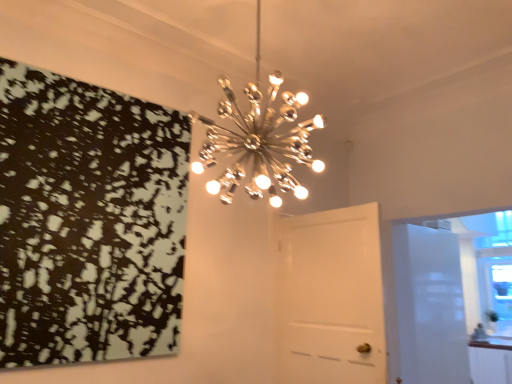
Measure the distance between white glossy cabinetry at lower right and camera.

white glossy cabinetry at lower right is 3.82 meters away from camera.

This screenshot has width=512, height=384. What do you see at coordinates (429, 305) in the screenshot?
I see `white glossy door at right, the 2th door when ordered from front to back` at bounding box center [429, 305].

What is the approximate width of white glossy door at center, the 2th door positioned from the right?

white glossy door at center, the 2th door positioned from the right, is 16.34 centimeters wide.

Describe the element at coordinates (331, 297) in the screenshot. I see `white glossy door at center, placed as the 1th door when sorted from front to back` at that location.

Describe the element at coordinates (88, 221) in the screenshot. This screenshot has height=384, width=512. I see `black matte print at upper left` at that location.

Where is `white glossy cabinetry at lower right`? white glossy cabinetry at lower right is located at coordinates pos(490,362).

Is metallic starburst chandelier at upper center outside of white glossy door at center, the 2th door positioned from the back?

Absolutely, metallic starburst chandelier at upper center is external to white glossy door at center, the 2th door positioned from the back.

Is metallic starburst chandelier at upper center not near white glossy door at center, the 1th door from the left?

Actually, metallic starburst chandelier at upper center and white glossy door at center, the 1th door from the left, are a little close together.

Locate an element on the screen. This screenshot has width=512, height=384. the 1st door located beneath the metallic starburst chandelier at upper center (from a real-world perspective) is located at coordinates (331, 297).

Considering the relative sizes of metallic starburst chandelier at upper center and white glossy door at center, the 2th door positioned from the right, in the image provided, is metallic starburst chandelier at upper center bigger than white glossy door at center, the 2th door positioned from the right,?

Indeed, metallic starburst chandelier at upper center has a larger size compared to white glossy door at center, the 2th door positioned from the right.

Is point (250, 195) farther from camera compared to point (496, 345)?

No, (250, 195) is in front of (496, 345).

Identify the location of lamp to the left of white glossy cabinetry at lower right. (258, 140).

From a real-world perspective, is metallic starburst chandelier at upper center beneath white glossy cabinetry at lower right?

Actually, metallic starburst chandelier at upper center is physically above white glossy cabinetry at lower right in the real world.

Does metallic starburst chandelier at upper center appear on the right side of white glossy cabinetry at lower right?

In fact, metallic starburst chandelier at upper center is to the left of white glossy cabinetry at lower right.

From the image's perspective, relative to white glossy door at right, the 2th door when ordered from front to back, is white glossy cabinetry at lower right above or below?

white glossy cabinetry at lower right is situated lower than white glossy door at right, the 2th door when ordered from front to back, in the image.

Does white glossy cabinetry at lower right have a smaller size compared to white glossy door at right, the 2th door when ordered from front to back?

Yes, white glossy cabinetry at lower right is smaller than white glossy door at right, the 2th door when ordered from front to back.

Which is closer, (469, 358) or (454, 319)?

Point (469, 358) appears to be closer to the viewer than point (454, 319).

From a real-world perspective, is white glossy door at right, which appears as the 2th door when viewed from the left, physically above white glossy cabinetry at lower right?

Yes, from a real-world perspective, white glossy door at right, which appears as the 2th door when viewed from the left, is on top of white glossy cabinetry at lower right.

In terms of size, does white glossy door at right, which is the first door in back-to-front order, appear bigger or smaller than white glossy cabinetry at lower right?

white glossy door at right, which is the first door in back-to-front order, is bigger than white glossy cabinetry at lower right.

Between white glossy door at right, which is the first door in back-to-front order, and white glossy cabinetry at lower right, which one appears on the left side from the viewer's perspective?

Positioned to the left is white glossy door at right, which is the first door in back-to-front order.

Is white glossy door at right, the first door positioned from the right, spatially inside white glossy cabinetry at lower right, or outside of it?

white glossy door at right, the first door positioned from the right, is spatially situated outside white glossy cabinetry at lower right.

What's the angular difference between metallic starburst chandelier at upper center and black matte print at upper left's facing directions?

There is a 1.87-degree angle between the facing directions of metallic starburst chandelier at upper center and black matte print at upper left.

In the scene shown: Does metallic starburst chandelier at upper center have a lesser width compared to black matte print at upper left?

Incorrect, the width of metallic starburst chandelier at upper center is not less than that of black matte print at upper left.

Is black matte print at upper left inside metallic starburst chandelier at upper center?

No, metallic starburst chandelier at upper center does not contain black matte print at upper left.

Is metallic starburst chandelier at upper center facing towards black matte print at upper left?

No, metallic starburst chandelier at upper center is not turned towards black matte print at upper left.

From a real-world perspective, is white glossy cabinetry at lower right positioned above or below black matte print at upper left?

white glossy cabinetry at lower right is below black matte print at upper left.

Is white glossy cabinetry at lower right bigger than black matte print at upper left?

Yes.

You are a GUI agent. You are given a task and a screenshot of the screen. Output one action in this format:
    pyautogui.click(x=<x>, y=<y>)
    Task: Click on the cabinetry behind the black matte print at upper left
    This screenshot has width=512, height=384.
    Given the screenshot: What is the action you would take?
    pyautogui.click(x=490, y=362)

Is white glossy cabinetry at lower right shorter than black matte print at upper left?

Yes, white glossy cabinetry at lower right is shorter than black matte print at upper left.

From a real-world perspective, relative to white glossy cabinetry at lower right, is white glossy door at center, placed as the 1th door when sorted from front to back, vertically above or below?

white glossy door at center, placed as the 1th door when sorted from front to back, is situated higher than white glossy cabinetry at lower right in the real world.

Is white glossy door at center, placed as the 1th door when sorted from front to back, to the right of white glossy cabinetry at lower right from the viewer's perspective?

No.

Considering the sizes of objects white glossy door at center, the 2th door positioned from the right, and white glossy cabinetry at lower right in the image provided, who is taller, white glossy door at center, the 2th door positioned from the right, or white glossy cabinetry at lower right?

white glossy door at center, the 2th door positioned from the right.

Does point (339, 274) appear closer or farther from the camera than point (497, 368)?

Point (339, 274) is closer to the camera than point (497, 368).

In order to click on lamp on the left side of white glossy door at center, the 2th door positioned from the back in this screenshot , I will do `click(258, 140)`.

Image resolution: width=512 pixels, height=384 pixels. I want to click on cabinetry lying on the right of metallic starburst chandelier at upper center, so click(x=490, y=362).

Based on their spatial positions, is white glossy cabinetry at lower right or metallic starburst chandelier at upper center closer to black matte print at upper left?

metallic starburst chandelier at upper center lies closer to black matte print at upper left than the other object.

Based on their spatial positions, is metallic starburst chandelier at upper center or white glossy cabinetry at lower right further from black matte print at upper left?

The object further to black matte print at upper left is white glossy cabinetry at lower right.

From the image, which object appears to be nearer to white glossy door at right, the 2th door when ordered from front to back, black matte print at upper left or white glossy door at center, the 1th door from the left?

white glossy door at center, the 1th door from the left, is positioned closer to the anchor white glossy door at right, the 2th door when ordered from front to back.

Based on their spatial positions, is white glossy cabinetry at lower right or white glossy door at center, the 2th door positioned from the back, further from white glossy door at right, the first door positioned from the right?

The object further to white glossy door at right, the first door positioned from the right, is white glossy door at center, the 2th door positioned from the back.

Looking at the image, which one is located closer to white glossy door at right, the 2th door when ordered from front to back, metallic starburst chandelier at upper center or black matte print at upper left?

metallic starburst chandelier at upper center lies closer to white glossy door at right, the 2th door when ordered from front to back, than the other object.

Considering their positions, is white glossy door at center, placed as the 1th door when sorted from front to back, positioned closer to white glossy cabinetry at lower right than black matte print at upper left?

white glossy door at center, placed as the 1th door when sorted from front to back, is closer to white glossy cabinetry at lower right.

Which object lies further to the anchor point black matte print at upper left, metallic starburst chandelier at upper center or white glossy door at right, the first door positioned from the right?

white glossy door at right, the first door positioned from the right, is positioned further to the anchor black matte print at upper left.

Based on their spatial positions, is white glossy cabinetry at lower right or black matte print at upper left closer to white glossy door at center, the 2th door positioned from the back?

black matte print at upper left lies closer to white glossy door at center, the 2th door positioned from the back, than the other object.

Where is `lamp located between black matte print at upper left and white glossy door at right, the 2th door when ordered from front to back, in the left-right direction`? This screenshot has height=384, width=512. lamp located between black matte print at upper left and white glossy door at right, the 2th door when ordered from front to back, in the left-right direction is located at coordinates (258, 140).

This screenshot has height=384, width=512. In order to click on lamp situated between black matte print at upper left and white glossy cabinetry at lower right from left to right in this screenshot , I will do `click(258, 140)`.

Find the location of `door between metallic starburst chandelier at upper center and white glossy door at right, which is the first door in back-to-front order, along the z-axis`. door between metallic starburst chandelier at upper center and white glossy door at right, which is the first door in back-to-front order, along the z-axis is located at coordinates (331, 297).

Where is `lamp situated between black matte print at upper left and white glossy door at center, the 2th door positioned from the right, from left to right`? lamp situated between black matte print at upper left and white glossy door at center, the 2th door positioned from the right, from left to right is located at coordinates [258, 140].